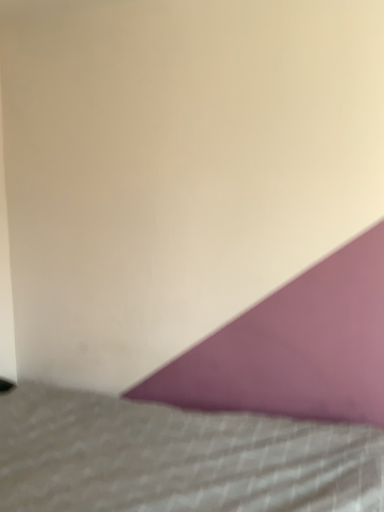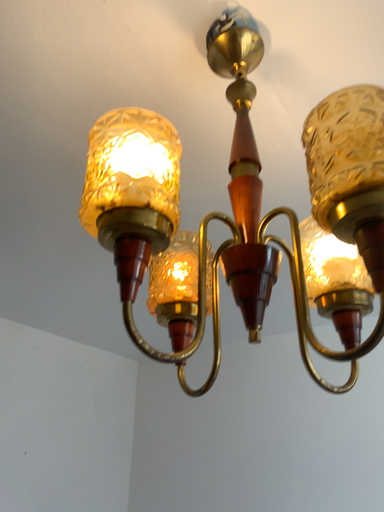
Question: How did the camera likely rotate when shooting the video?

Choices:
 (A) rotated upward
 (B) rotated downward

Answer: (A)